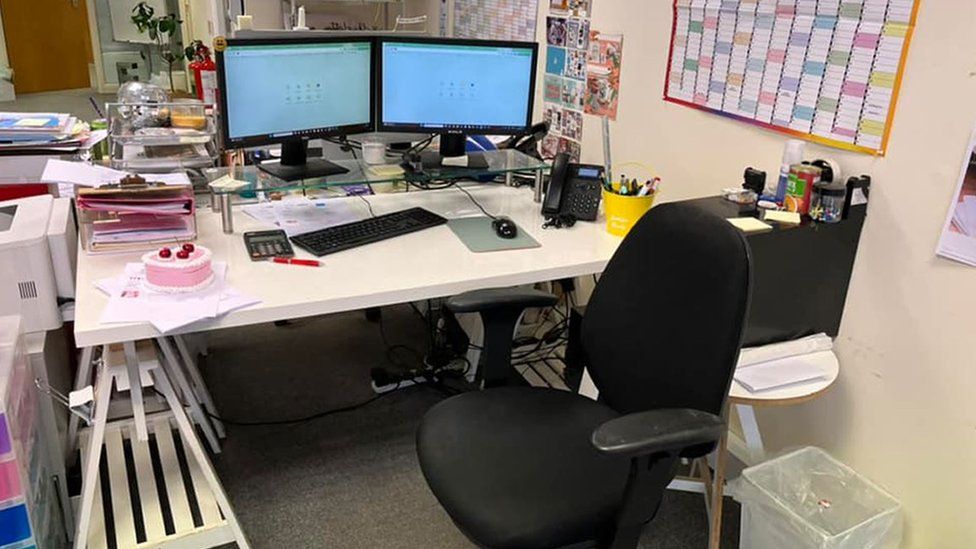
What are the coordinates of `mousepad` in the screenshot? It's located at (461, 223).